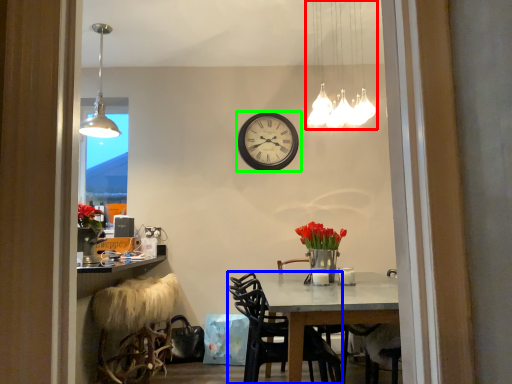
Question: Considering the real-world distances, which object is farthest from lamp (highlighted by a red box)? chair (highlighted by a blue box) or wall clock (highlighted by a green box)?

Choices:
 (A) chair
 (B) wall clock

Answer: (A)